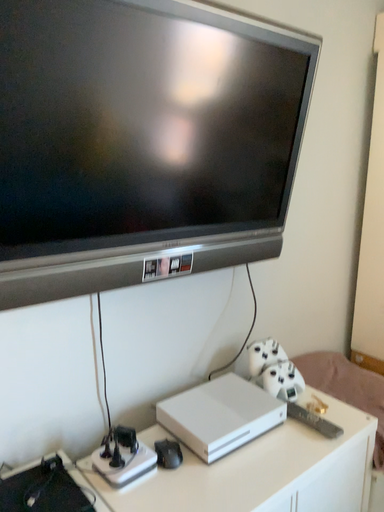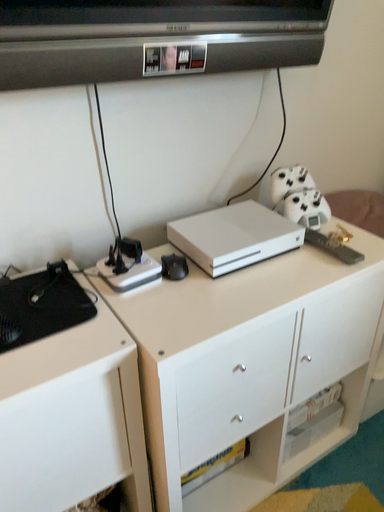
Question: Which way did the camera rotate in the video?

Choices:
 (A) rotated downward
 (B) rotated upward

Answer: (A)